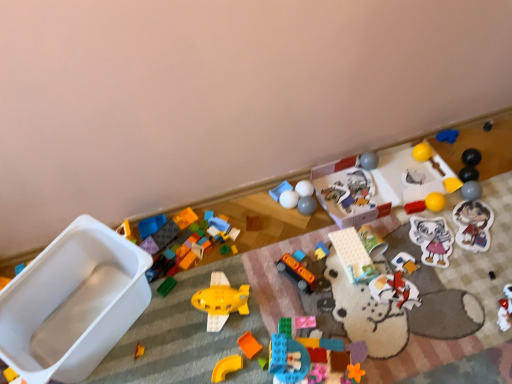
The height and width of the screenshot is (384, 512). Find the location of `free area in between white plastic toy at center, which is the seventeenth toy from left to right, and matte gray ball at center, which is counted as the twelfth toy, starting from the right`. free area in between white plastic toy at center, which is the seventeenth toy from left to right, and matte gray ball at center, which is counted as the twelfth toy, starting from the right is located at coordinates (321, 208).